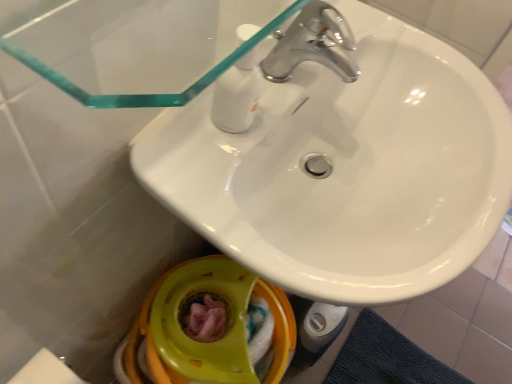
Question: From the image's perspective, would you say chrome metallic faucet at upper center, arranged as the 2th tap when ordered from the bottom, is shown under chrome metallic faucet at upper center, the second tap from the top?

Choices:
 (A) yes
 (B) no

Answer: (B)

Question: From a real-world perspective, does chrome metallic faucet at upper center, the 1th tap viewed from the top, sit lower than chrome metallic faucet at upper center, the second tap from the top?

Choices:
 (A) yes
 (B) no

Answer: (A)

Question: Does chrome metallic faucet at upper center, arranged as the 2th tap when ordered from the bottom, have a lesser height compared to chrome metallic faucet at upper center, the second tap from the top?

Choices:
 (A) yes
 (B) no

Answer: (A)

Question: Considering the relative positions of chrome metallic faucet at upper center, the 1th tap viewed from the top, and chrome metallic faucet at upper center, the second tap from the top, in the image provided, is chrome metallic faucet at upper center, the 1th tap viewed from the top, to the left of chrome metallic faucet at upper center, the second tap from the top, from the viewer's perspective?

Choices:
 (A) no
 (B) yes

Answer: (A)

Question: Is chrome metallic faucet at upper center, the 1th tap viewed from the top, facing away from chrome metallic faucet at upper center, which is the first tap from bottom to top?

Choices:
 (A) yes
 (B) no

Answer: (B)

Question: Considering their positions, is chrome metallic faucet at upper center, which is the first tap from bottom to top, located in front of or behind chrome metallic faucet at upper center, arranged as the 2th tap when ordered from the bottom?

Choices:
 (A) front
 (B) behind

Answer: (A)

Question: From a real-world perspective, is chrome metallic faucet at upper center, the second tap from the top, positioned above or below chrome metallic faucet at upper center, the 1th tap viewed from the top?

Choices:
 (A) below
 (B) above

Answer: (B)

Question: Is chrome metallic faucet at upper center, the second tap from the top, to the left or to the right of chrome metallic faucet at upper center, arranged as the 2th tap when ordered from the bottom, in the image?

Choices:
 (A) left
 (B) right

Answer: (A)

Question: From the image's perspective, is chrome metallic faucet at upper center, which is the first tap from bottom to top, above or below chrome metallic faucet at upper center, arranged as the 2th tap when ordered from the bottom?

Choices:
 (A) above
 (B) below

Answer: (B)

Question: Considering their positions, is white glossy sink at upper center located in front of or behind chrome metallic faucet at upper center, which is the first tap from bottom to top?

Choices:
 (A) front
 (B) behind

Answer: (A)

Question: From a real-world perspective, is white glossy sink at upper center physically located above or below chrome metallic faucet at upper center, the second tap from the top?

Choices:
 (A) above
 (B) below

Answer: (B)

Question: Is white glossy sink at upper center inside or outside of chrome metallic faucet at upper center, the second tap from the top?

Choices:
 (A) outside
 (B) inside

Answer: (A)

Question: Is white glossy sink at upper center bigger or smaller than chrome metallic faucet at upper center, which is the first tap from bottom to top?

Choices:
 (A) small
 (B) big

Answer: (B)

Question: Would you say chrome metallic faucet at upper center, the second tap from the top, is inside or outside white glossy sink at upper center?

Choices:
 (A) outside
 (B) inside

Answer: (A)

Question: From the image's perspective, is chrome metallic faucet at upper center, the second tap from the top, positioned above or below white glossy sink at upper center?

Choices:
 (A) below
 (B) above

Answer: (B)